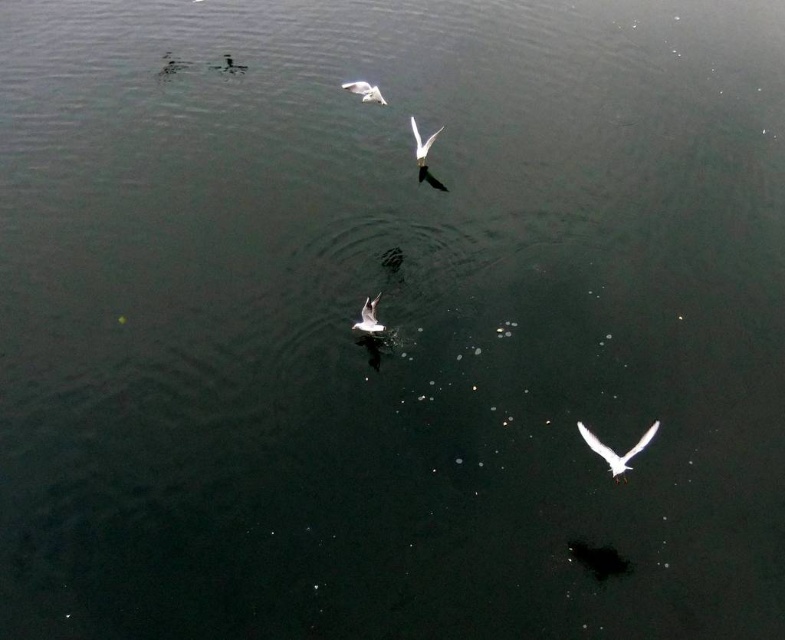
You are an ornithologist observing two birds in the image. The birds are labeled as the white matte bird at center and the white matte bird at upper left. Based on their physical characteristics, which bird has a more slender body shape?

The white matte bird at center is thinner than the white matte bird at upper left, so it has a more slender body shape.